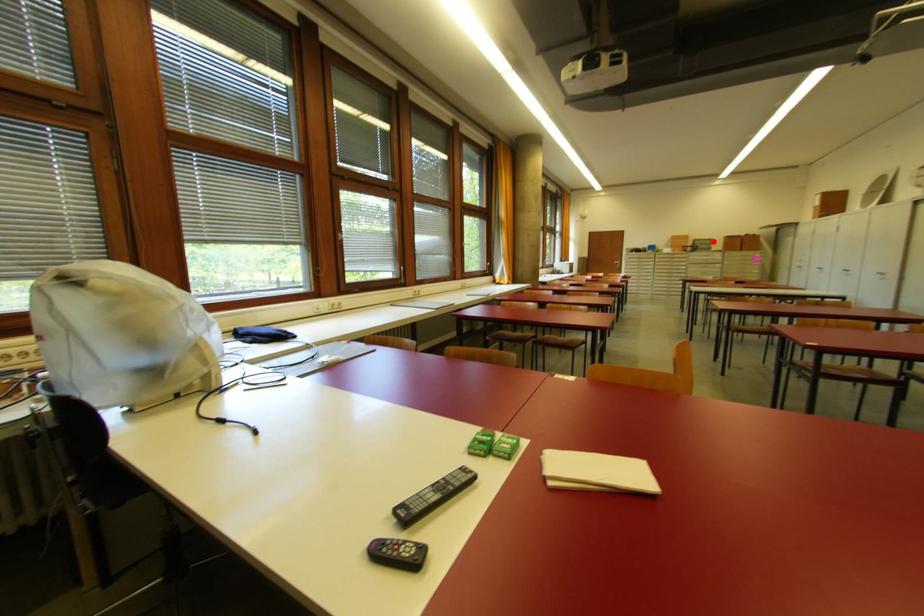
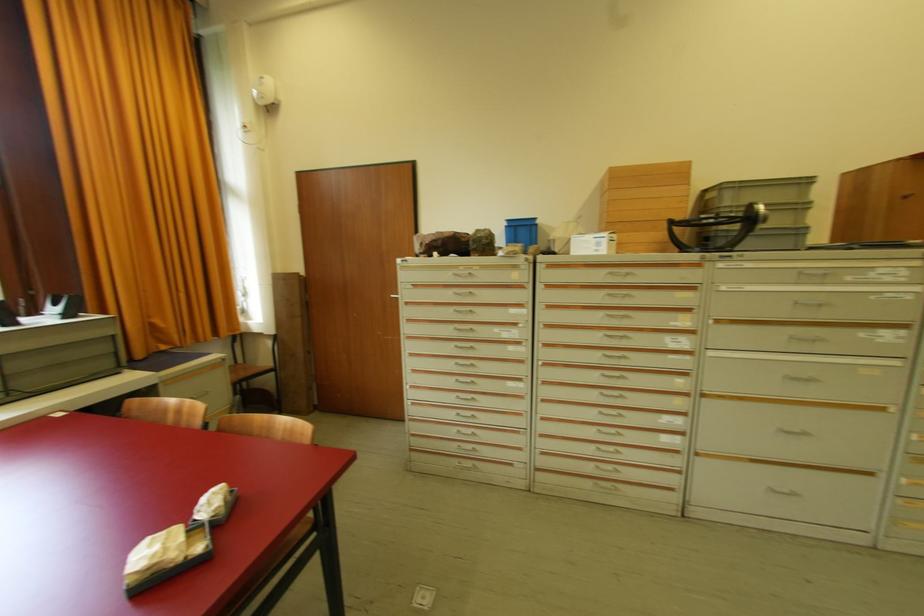
Question: I am providing you with two images of the same scene from different viewpoints. A red point is marked on the first image. At the location where the point appears in image 1, is it still visible in image 2?

Choices:
 (A) Yes
 (B) No

Answer: (A)